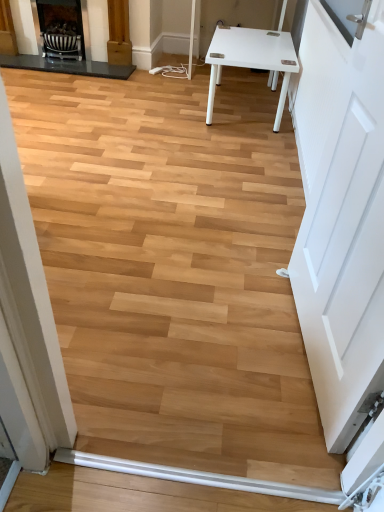
Question: From a real-world perspective, is matte black fireplace at upper left, which is the 1th fireplace in left-to-right order, physically located above or below white smooth baseboard at lower center?

Choices:
 (A) above
 (B) below

Answer: (A)

Question: Visually, is matte black fireplace at upper left, the 2th fireplace positioned from the right, positioned to the left or to the right of white smooth baseboard at lower center?

Choices:
 (A) left
 (B) right

Answer: (A)

Question: Estimate the real-world distances between objects in this image. Which object is farther from the matte black fireplace at upper left, which is the first fireplace from right to left?

Choices:
 (A) white matte door at right
 (B) white smooth baseboard at lower center
 (C) matte black fireplace at upper left, the 2th fireplace positioned from the right

Answer: (B)

Question: Which object is positioned closest to the white smooth baseboard at lower center?

Choices:
 (A) matte black fireplace at upper left, the 2th fireplace positioned from the right
 (B) matte black fireplace at upper left, acting as the 2th fireplace starting from the left
 (C) white matte door at right

Answer: (C)